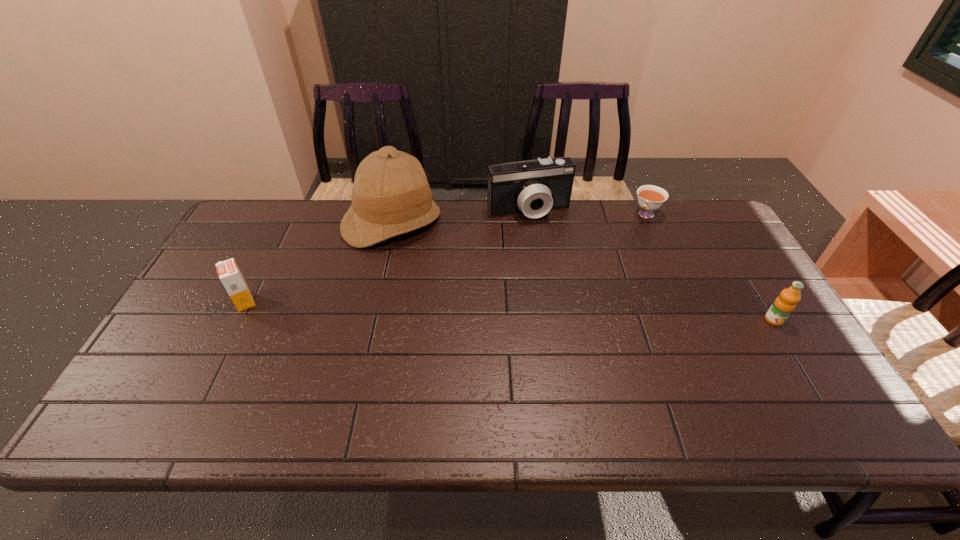
Find the location of `free space located on the front-facing side of the tallest object`. free space located on the front-facing side of the tallest object is located at coordinates (441, 297).

This screenshot has width=960, height=540. I want to click on teacup that is at the far edge, so click(x=650, y=197).

Locate an element on the screen. The height and width of the screenshot is (540, 960). camcorder located at the far edge is located at coordinates (533, 187).

This screenshot has height=540, width=960. What are the coordinates of `hat present at the far edge` in the screenshot? It's located at (391, 196).

Find the location of a particular element. object present at the left edge is located at coordinates tap(228, 271).

The width and height of the screenshot is (960, 540). I want to click on object that is positioned at the right edge, so click(x=784, y=304).

Find the location of a particular element. The height and width of the screenshot is (540, 960). free space at the far edge of the desktop is located at coordinates (536, 219).

You are a GUI agent. You are given a task and a screenshot of the screen. Output one action in this format:
    pyautogui.click(x=<x>, y=<y>)
    Task: Click on the vacant space at the near edge
    This screenshot has width=960, height=540.
    Given the screenshot: What is the action you would take?
    pyautogui.click(x=711, y=383)

In the image, there is a desktop. Identify the location of blank space at the left edge. The image size is (960, 540). (162, 357).

At what (x,y) coordinates should I click in order to perform the action: click on vacant area at the right edge of the desktop. Please return your answer as a coordinate pair (x, y). The height and width of the screenshot is (540, 960). Looking at the image, I should click on (736, 296).